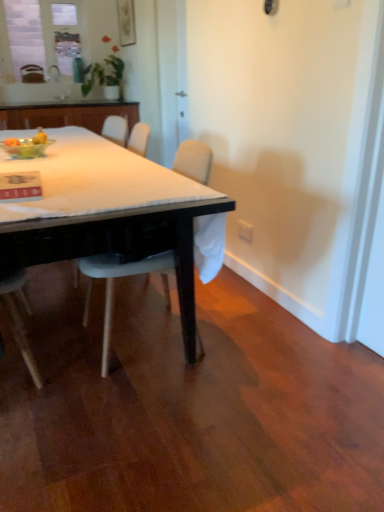
At what (x,y) coordinates should I click in order to perform the action: click on vacant space that is to the left of white plastic chair at center, which appears as the first chair when viewed from the right. Please return your answer as a coordinate pair (x, y). The width and height of the screenshot is (384, 512). Looking at the image, I should click on (53, 338).